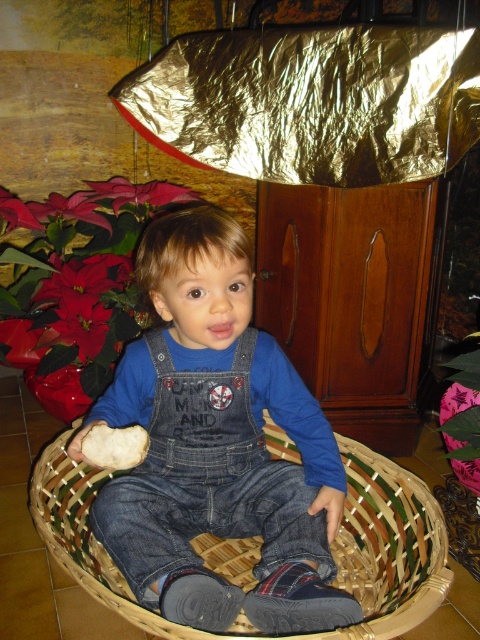
Which is more to the right, denim overalls at center or woven wood basket at center?

woven wood basket at center

Is point (139, 387) closer to viewer compared to point (41, 518)?

No, it is not.

Is point (195, 376) positioned in front of point (439, 529)?

That is False.

Find the location of a particular element. Image resolution: width=480 pixels, height=640 pixels. denim overalls at center is located at coordinates (216, 445).